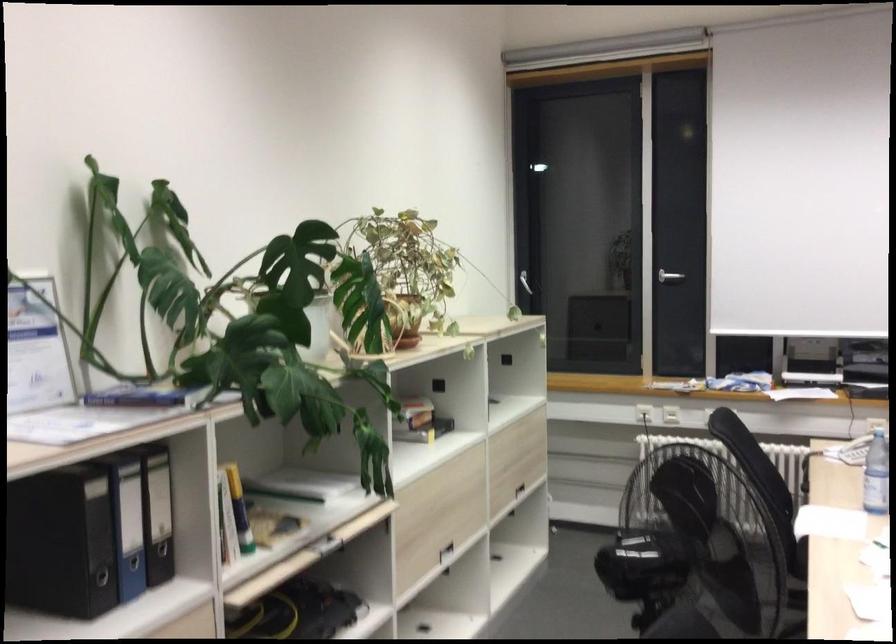
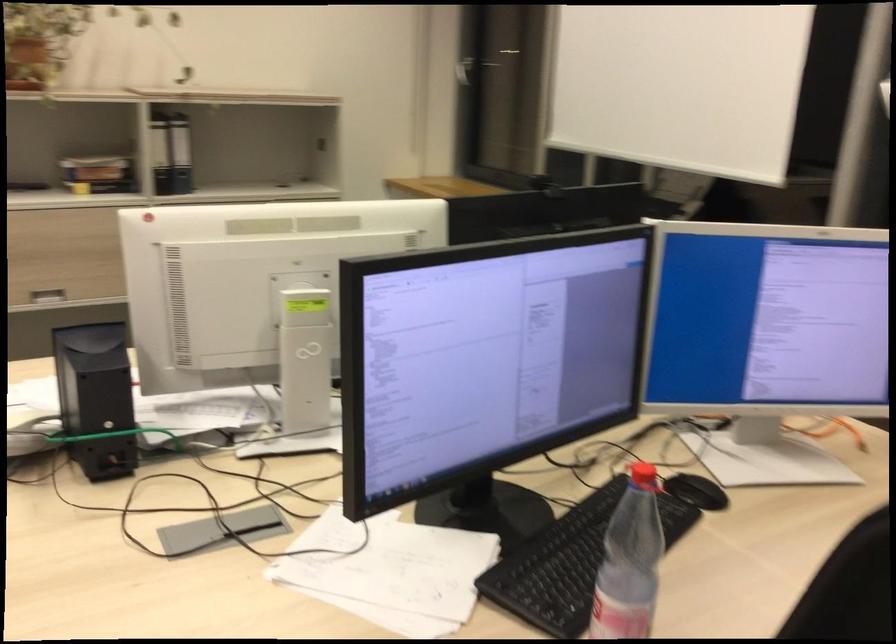
Locate, in the second image, the point that corresponds to (x=436, y=420) in the first image.

(105, 175)